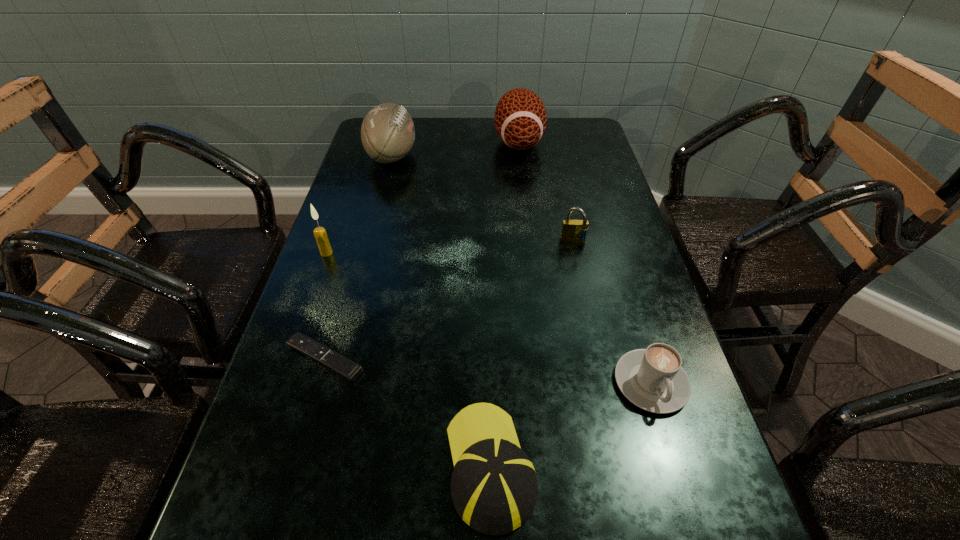
This screenshot has width=960, height=540. Identify the location of free space located on the front of the candle. (285, 369).

The image size is (960, 540). I want to click on blank area located on the side with the combination dials of the fifth nearest object, so click(x=579, y=265).

Find the location of a particular element. vacant space located 0.050m with the brim of the baseball cap facing forward is located at coordinates (489, 382).

Where is `vacant space located 0.230m with the brim of the baseball cap facing forward`? The image size is (960, 540). vacant space located 0.230m with the brim of the baseball cap facing forward is located at coordinates (488, 305).

At what (x,y) coordinates should I click in order to perform the action: click on blank space located 0.270m with the brim of the baseball cap facing forward. Please return your answer as a coordinate pair (x, y). This screenshot has height=540, width=960. Looking at the image, I should click on (488, 291).

Where is `free location located to the right of the cappuccino`? free location located to the right of the cappuccino is located at coordinates (688, 505).

I want to click on vacant region located 0.260m on the right of the shortest object, so click(505, 358).

Find the location of a particular element. Image resolution: width=960 pixels, height=540 pixels. football (American) located in the left edge section of the desktop is located at coordinates (387, 132).

Find the location of a particular element. The image size is (960, 540). candle that is at the left edge is located at coordinates (320, 234).

You are a GUI agent. You are given a task and a screenshot of the screen. Output one action in this format:
    pyautogui.click(x=<x>, y=<y>)
    Task: Click on the remote control located in the left edge section of the desktop
    The image size is (960, 540).
    Given the screenshot: What is the action you would take?
    tap(347, 369)